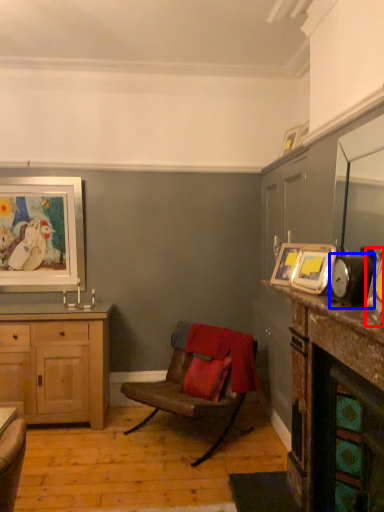
Question: Which of the following is the closest to the observer, picture frame (highlighted by a red box) or alarm clock (highlighted by a blue box)?

Choices:
 (A) picture frame
 (B) alarm clock

Answer: (A)